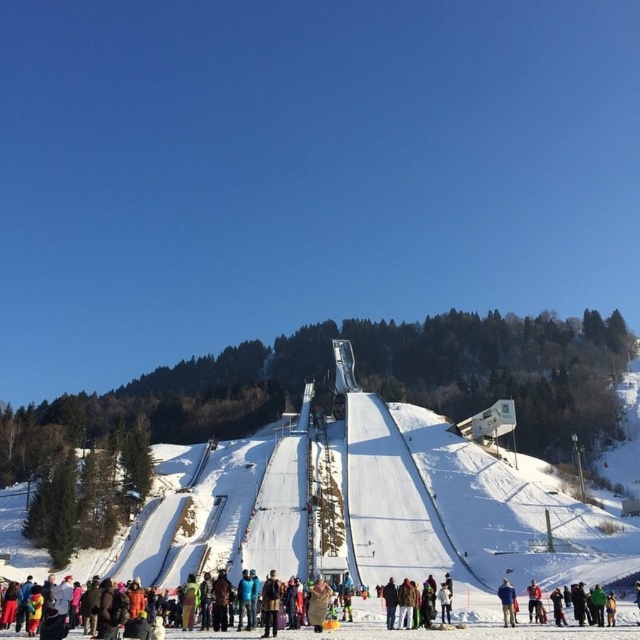
Question: Among these objects, which one is farthest from the camera?

Choices:
 (A) blue woolen sweater at center
 (B) red wool sweater at center

Answer: (B)

Question: Which object appears closest to the camera in this image?

Choices:
 (A) brown wool coat at center
 (B) white snowboarder at center

Answer: (B)

Question: Is white snowboarder at center to the left of brown wool coat at center from the viewer's perspective?

Choices:
 (A) yes
 (B) no

Answer: (B)

Question: Does white snowboarder at center have a smaller size compared to brown wool coat at center?

Choices:
 (A) no
 (B) yes

Answer: (A)

Question: Can you confirm if brown wool coat at center is wider than blue woolen sweater at center?

Choices:
 (A) no
 (B) yes

Answer: (A)

Question: Which point is closer to the camera?

Choices:
 (A) brown wool coat at center
 (B) red wool sweater at center
 (C) blue woolen sweater at center

Answer: (A)